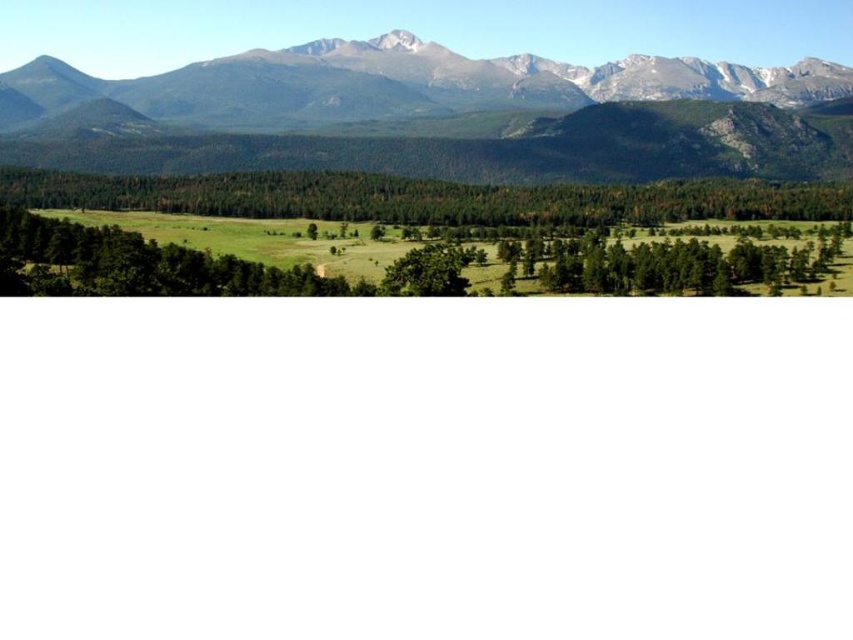
You are planning to hike from the green matte forest at center to the rocky gray mountain range at upper center. Given that the average walking speed is 5 km per hour, how long would it take you to reach the mountain range?

The distance between the green matte forest at center and the rocky gray mountain range at upper center is 260.36 meters. Converting meters to kilometers, it becomes 0.26036 km. Dividing this by the walking speed of 5 km per hour gives approximately 0.052 hours. Multiplying by 60 minutes per hour yields roughly 3.12 minutes. Therefore, it would take approximately 3 minutes to reach the rocky gray mountain range at upper center.

You are planning to plant a new tree in the green matte forest at center. Considering the size of the existing green matte tree at center, will the new tree have enough space to grow?

The green matte forest at center has a larger size compared to the green matte tree at center, so there is sufficient space for the new tree to grow.